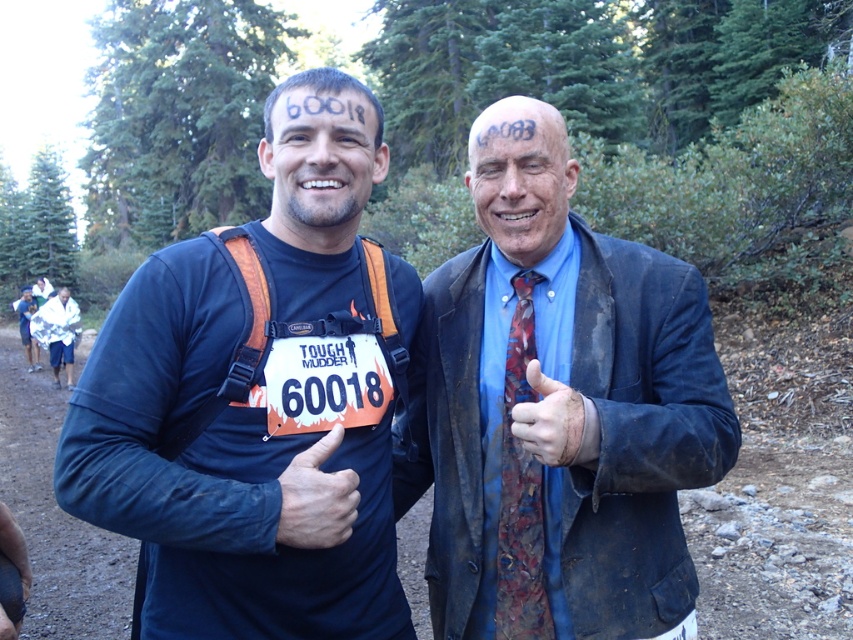
Who is higher up, blue wrinkled suit at right or smooth skin face at center?

smooth skin face at center

Is point (457, 577) positioned before point (532, 253)?

Yes, point (457, 577) is closer to viewer.

Where is `blue wrinkled suit at right`? blue wrinkled suit at right is located at coordinates click(583, 404).

In the scene shown: Is smooth skin face at center shorter than matte blue thumb at center?

Answer: Incorrect, smooth skin face at center's height does not fall short of matte blue thumb at center's.

Which is behind, point (554, 228) or point (341, 433)?

Positioned behind is point (554, 228).

The width and height of the screenshot is (853, 640). What do you see at coordinates (520, 177) in the screenshot?
I see `smooth skin face at center` at bounding box center [520, 177].

Where is `smooth skin face at center`? Image resolution: width=853 pixels, height=640 pixels. smooth skin face at center is located at coordinates (520, 177).

Between matte blue shirt at center and matte black face at center, which one is positioned higher?

matte black face at center is above.

Does matte blue shirt at center have a greater width compared to matte black face at center?

Yes.

Between point (286, 506) and point (259, 141), which one is positioned behind?

Point (259, 141)

Find the location of a particular element. This screenshot has width=853, height=640. matte blue shirt at center is located at coordinates (259, 401).